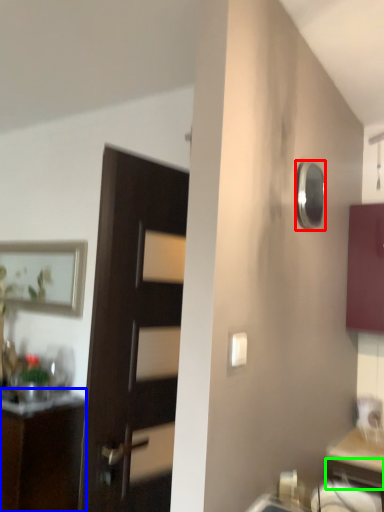
Question: Which object is the closest to the mirror (highlighted by a red box)? Choose among these: cabinetry (highlighted by a blue box) or drawer (highlighted by a green box).

Choices:
 (A) cabinetry
 (B) drawer

Answer: (B)